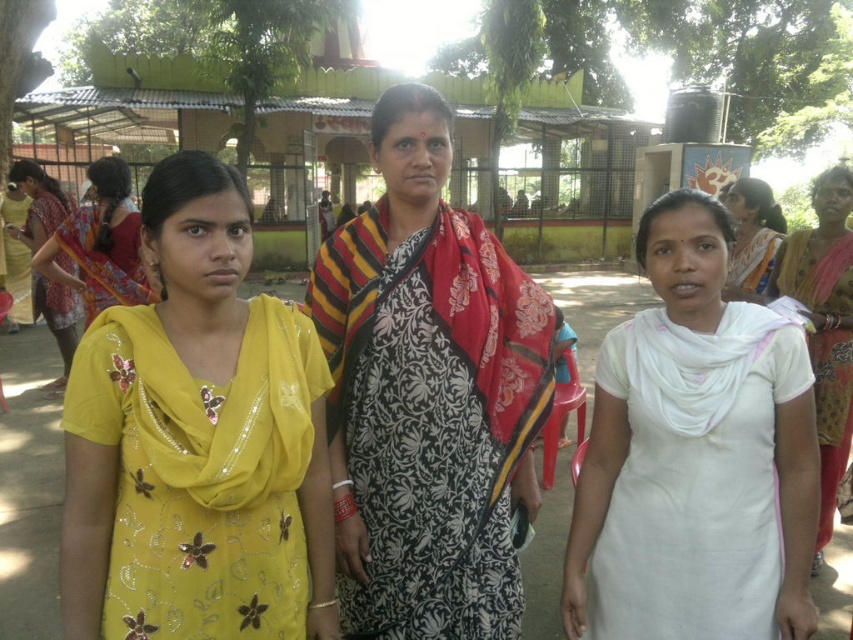
In the scene shown: You are a fashion designer observing the scene and want to create a new collection inspired by the outfits. Which of the two yellow garments, the matte yellow dress at center or the yellow fabric saree at left, would you choose if you want to emphasize a shorter length in your design?

The matte yellow dress at center is shorter than the yellow fabric saree at left, so choosing the matte yellow dress at center would emphasize a shorter length in the design.